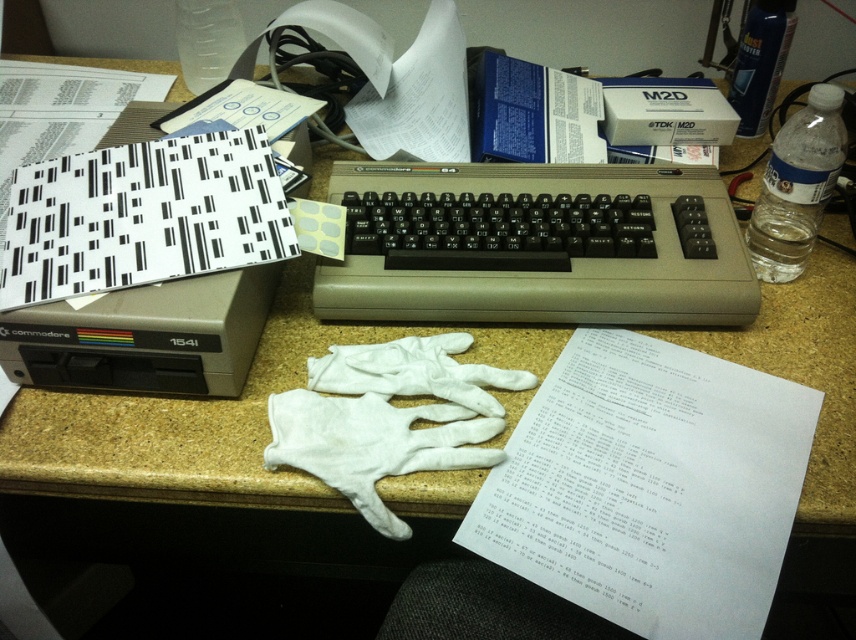
Question: Which point is farther to the camera?

Choices:
 (A) (510, 486)
 (B) (317, 282)

Answer: (B)

Question: Does white paper at center appear on the left side of beige laminate counter top at center?

Choices:
 (A) yes
 (B) no

Answer: (B)

Question: Which point is farther to the camera?

Choices:
 (A) (383, 240)
 (B) (301, 276)
 (C) (646, 522)

Answer: (B)

Question: Is white paper at center wider than beige laminate counter top at center?

Choices:
 (A) no
 (B) yes

Answer: (A)

Question: Is white paper at center positioned before beige laminate counter top at center?

Choices:
 (A) yes
 (B) no

Answer: (A)

Question: Among these points, which one is nearest to the camera?

Choices:
 (A) (282, 348)
 (B) (795, 483)
 (C) (669, 212)

Answer: (B)